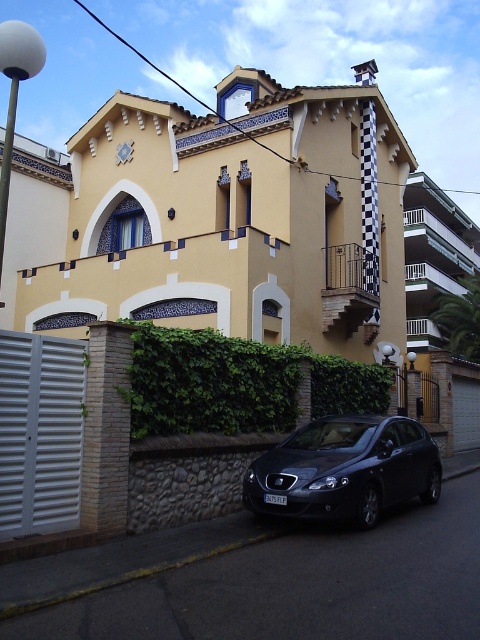
You are a gardener who needs to plant a new tree in the front yard of the Mediterranean building. The tree requires a space that is larger than the green leafy hedge at center. Can the space currently occupied by the matte black car at lower center accommodate the tree?

The green leafy hedge at center is smaller than the matte black car at lower center. Since the tree requires a space larger than the hedge, the space occupied by the matte black car at lower center is sufficient to accommodate the tree.

You are standing at the entrance of the building and want to water the green leafy hedge at center. If your watering can has a maximum range of 30 feet, can you reach the hedge without moving closer?

The green leafy hedge at center is 29.75 feet away from the camera, so yes, the watering can can reach it since its range is sufficient.

Consider the image. You are standing in front of the residential building and want to determine the relative positions of two points marked on its facade. The first point is at coordinates point (x=204, y=344), and the second is at point (x=409, y=417). Which of these points is closer to you?

Point (x=204, y=344) is closer to the viewer than point (x=409, y=417).